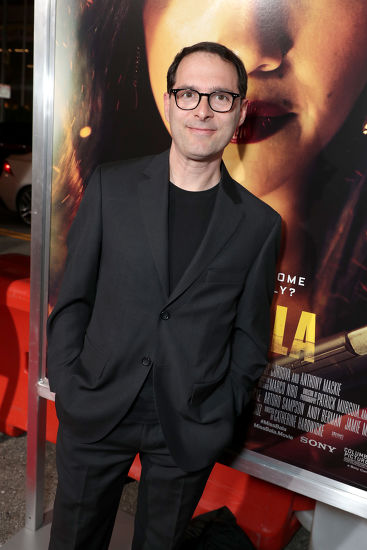
I want to click on poster, so click(x=74, y=46).